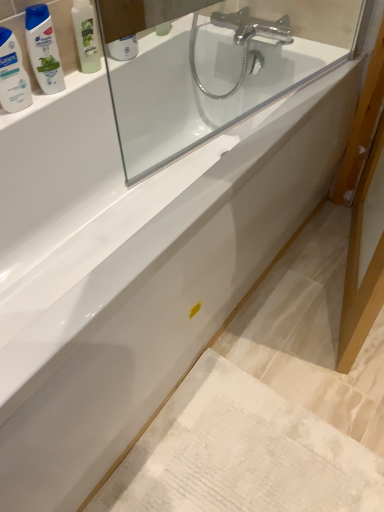
Question: From the image's perspective, does green matte shampoo bottle at upper left appear higher than white glossy bottle at upper left?

Choices:
 (A) yes
 (B) no

Answer: (A)

Question: From a real-world perspective, is green matte shampoo bottle at upper left located higher than white glossy bottle at upper left?

Choices:
 (A) yes
 (B) no

Answer: (A)

Question: Is green matte shampoo bottle at upper left shorter than white glossy bottle at upper left?

Choices:
 (A) yes
 (B) no

Answer: (B)

Question: Considering the relative sizes of green matte shampoo bottle at upper left and white glossy bottle at upper left in the image provided, is green matte shampoo bottle at upper left taller than white glossy bottle at upper left?

Choices:
 (A) no
 (B) yes

Answer: (B)

Question: From a real-world perspective, is green matte shampoo bottle at upper left located beneath white glossy bottle at upper left?

Choices:
 (A) yes
 (B) no

Answer: (B)

Question: From a real-world perspective, relative to white textured bath mat at lower right, is white glossy bottle at upper left vertically above or below?

Choices:
 (A) above
 (B) below

Answer: (A)

Question: Based on their sizes in the image, would you say white glossy bottle at upper left is bigger or smaller than white textured bath mat at lower right?

Choices:
 (A) small
 (B) big

Answer: (A)

Question: Considering their positions, is white glossy bottle at upper left located in front of or behind white textured bath mat at lower right?

Choices:
 (A) behind
 (B) front

Answer: (A)

Question: Based on their positions, is white glossy bottle at upper left located to the left or right of white textured bath mat at lower right?

Choices:
 (A) left
 (B) right

Answer: (A)

Question: Does point (210, 372) appear closer or farther from the camera than point (31, 19)?

Choices:
 (A) closer
 (B) farther

Answer: (B)

Question: Is white textured bath mat at lower right to the left or to the right of green plastic mouthwash at upper left in the image?

Choices:
 (A) right
 (B) left

Answer: (A)

Question: Considering their positions, is white textured bath mat at lower right located in front of or behind green plastic mouthwash at upper left?

Choices:
 (A) behind
 (B) front

Answer: (B)

Question: Would you say white textured bath mat at lower right is inside or outside green plastic mouthwash at upper left?

Choices:
 (A) inside
 (B) outside

Answer: (B)

Question: Is transparent glass mirror at upper center to the left or to the right of white glossy bottle at upper left in the image?

Choices:
 (A) left
 (B) right

Answer: (B)

Question: Considering the positions of transparent glass mirror at upper center and white glossy bottle at upper left in the image, is transparent glass mirror at upper center wider or thinner than white glossy bottle at upper left?

Choices:
 (A) thin
 (B) wide

Answer: (A)